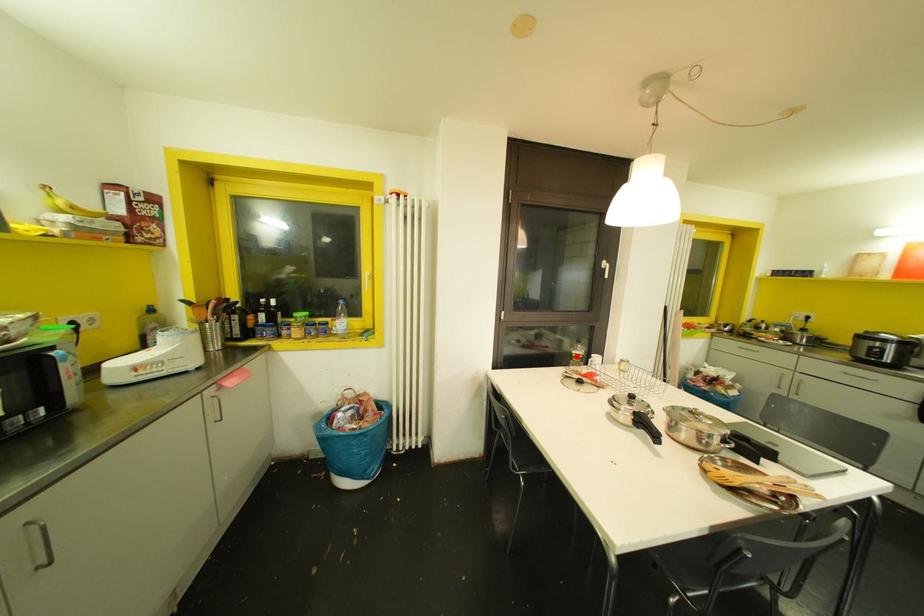
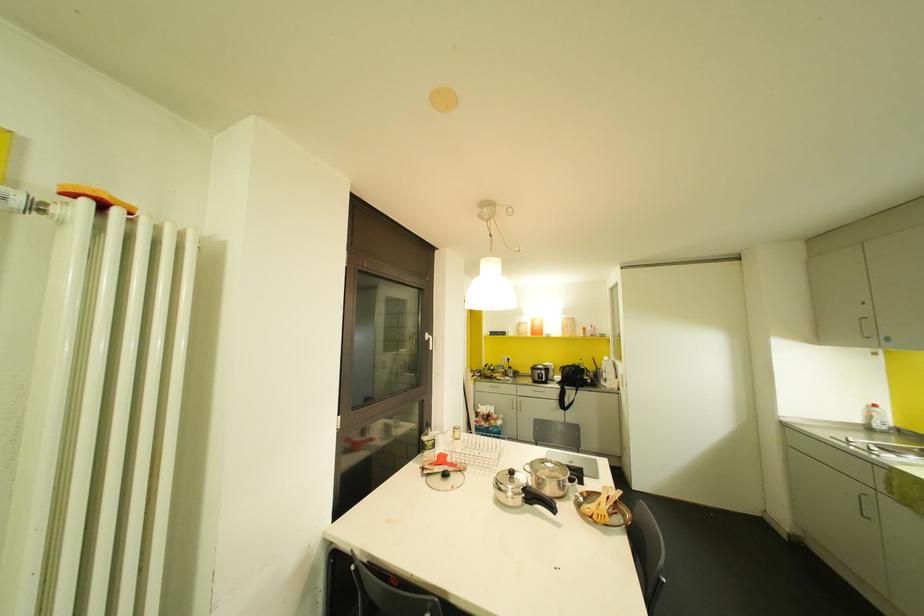
Question: I am providing you with two images of the same scene from different viewpoints. In image1, a red point is highlighted. Considering the same 3D point in image2, which of the following is correct?

Choices:
 (A) It is closer
 (B) It is farther

Answer: (B)